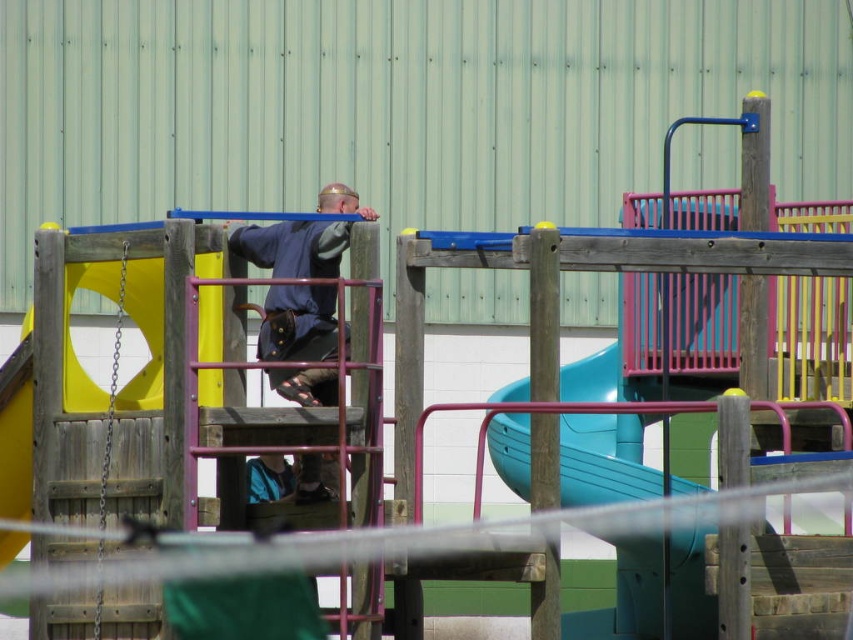
Question: Estimate the real-world distances between objects in this image. Which object is farther from the metallic chain swing at left?

Choices:
 (A) blue fabric pants at lower center
 (B) dark blue fabric shirt at center

Answer: (A)

Question: Which of the following is the closest to the observer?

Choices:
 (A) dark blue fabric shirt at center
 (B) blue fabric pants at lower center
 (C) metallic chain swing at left

Answer: (C)

Question: Does metallic chain swing at left lie behind blue fabric pants at lower center?

Choices:
 (A) yes
 (B) no

Answer: (B)

Question: Which of the following is the closest to the observer?

Choices:
 (A) (97, 554)
 (B) (347, 228)

Answer: (A)

Question: Is metallic chain swing at left behind blue fabric pants at lower center?

Choices:
 (A) no
 (B) yes

Answer: (A)

Question: Does dark blue fabric shirt at center have a larger size compared to blue fabric pants at lower center?

Choices:
 (A) yes
 (B) no

Answer: (A)